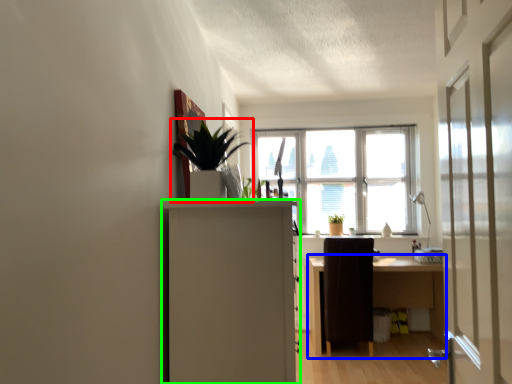
Question: Which object is the farthest from houseplant (highlighted by a red box)? Choose among these: desk (highlighted by a blue box) or cabinetry (highlighted by a green box).

Choices:
 (A) desk
 (B) cabinetry

Answer: (A)